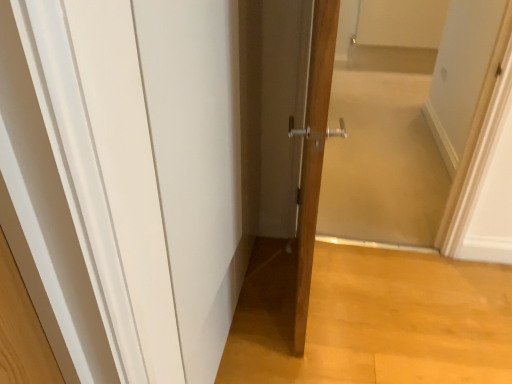
Question: Does transparent glass door at center appear on the right side of wooden door at center?

Choices:
 (A) no
 (B) yes

Answer: (B)

Question: Is transparent glass door at center behind wooden door at center?

Choices:
 (A) yes
 (B) no

Answer: (A)

Question: Is transparent glass door at center at the left side of wooden door at center?

Choices:
 (A) no
 (B) yes

Answer: (A)

Question: Is transparent glass door at center thinner than wooden door at center?

Choices:
 (A) yes
 (B) no

Answer: (B)

Question: Are transparent glass door at center and wooden door at center located far from each other?

Choices:
 (A) yes
 (B) no

Answer: (A)

Question: From a real-world perspective, does transparent glass door at center stand above wooden door at center?

Choices:
 (A) no
 (B) yes

Answer: (A)

Question: Are wooden door at center and transparent glass door at center far apart?

Choices:
 (A) yes
 (B) no

Answer: (A)

Question: Is wooden door at center beside transparent glass door at center?

Choices:
 (A) no
 (B) yes

Answer: (A)

Question: From a real-world perspective, is wooden door at center positioned under transparent glass door at center based on gravity?

Choices:
 (A) no
 (B) yes

Answer: (A)

Question: Considering the relative sizes of wooden door at center and transparent glass door at center in the image provided, is wooden door at center shorter than transparent glass door at center?

Choices:
 (A) no
 (B) yes

Answer: (A)

Question: Is wooden door at center at the left side of transparent glass door at center?

Choices:
 (A) no
 (B) yes

Answer: (B)

Question: Is wooden door at center thinner than transparent glass door at center?

Choices:
 (A) yes
 (B) no

Answer: (A)

Question: Is transparent glass door at center taller or shorter than wooden door at center?

Choices:
 (A) short
 (B) tall

Answer: (A)